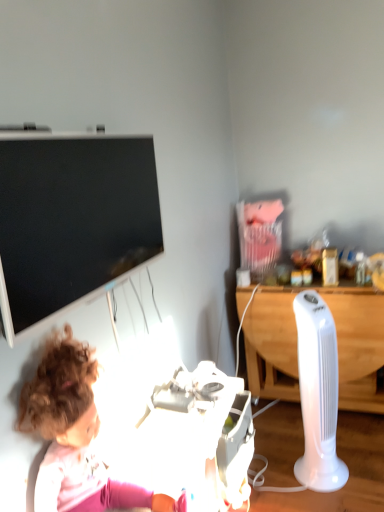
Question: From the image's perspective, is white plastic toy at lower center, which is counted as the first equipment, starting from the left, positioned above or below black glossy television at upper left?

Choices:
 (A) below
 (B) above

Answer: (A)

Question: Looking at their shapes, would you say white plastic toy at lower center, the second equipment from the right, is wider or thinner than black glossy television at upper left?

Choices:
 (A) thin
 (B) wide

Answer: (B)

Question: Which object is positioned closest to the white wood desk at right?

Choices:
 (A) black glossy television at upper left
 (B) white plastic fan at right, acting as the first equipment starting from the right
 (C) white plastic toy at lower center, which is counted as the first equipment, starting from the left
 (D) curly-haired doll at lower left

Answer: (B)

Question: Considering the real-world distances, which object is closest to the white wood desk at right?

Choices:
 (A) white plastic fan at right, acting as the first equipment starting from the right
 (B) white plastic toy at lower center, the second equipment from the right
 (C) black glossy television at upper left
 (D) curly-haired doll at lower left

Answer: (A)